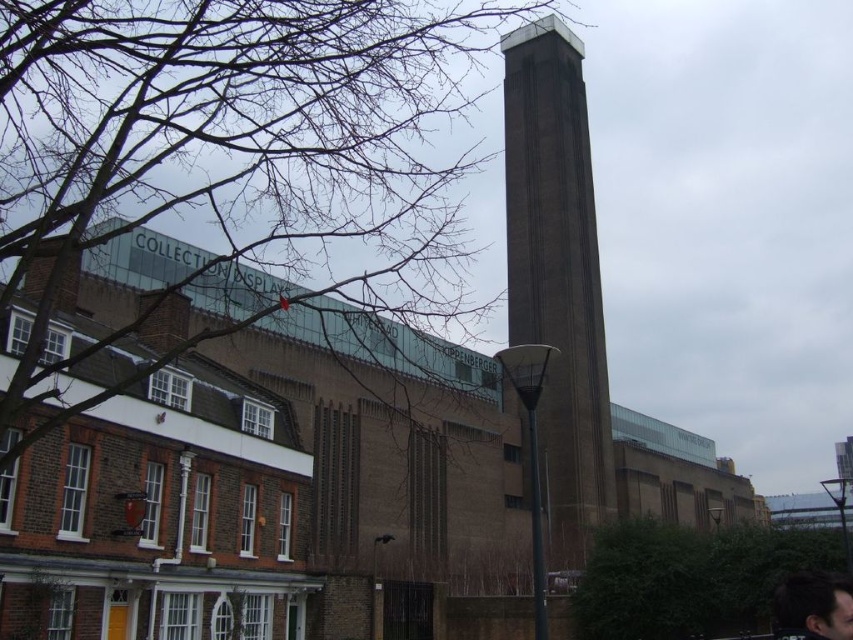
You are a photographer trying to capture both the brown brick tower at center and the dark brown hair at lower right in the same frame. Based on their positions, which one would appear larger in the photo?

The brown brick tower at center appears larger in the photo because it is positioned over the dark brown hair at lower right, indicating it is closer to the camera and thus larger in the frame.

You are standing in front of the modern architectural structure and the traditional brick building. There is a point at coordinates (556,276). Based on the scene description, can you determine which building this point is located on?

The point at (556,276) is on the brown brick tower at center, which is the modern architectural structure described as having a tall, rectangular tower with a flat top made of dark brown material.

You are standing at the point closest to the traditional red brick building. Which point, point (563,429) or point (830,605), is farther away from you?

Point (563,429) is farther away from you because it is behind point (830,605).